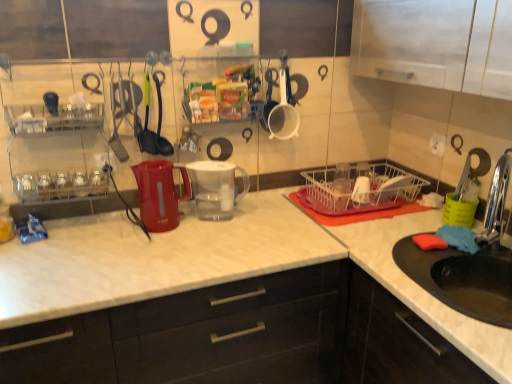
Find the location of `free space that is in between transparent plastic water filter pitcher at center, the 2th appliance positioned from the left, and white wire basket at center`. free space that is in between transparent plastic water filter pitcher at center, the 2th appliance positioned from the left, and white wire basket at center is located at coordinates (275, 211).